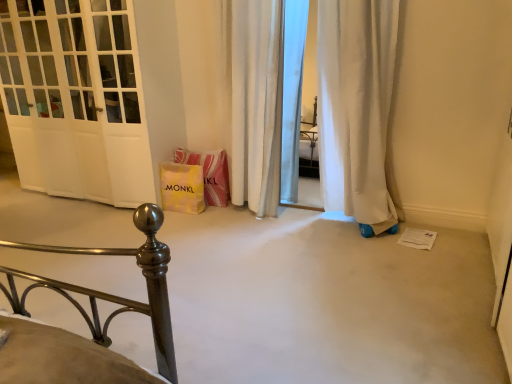
Question: Considering the relative positions of white fabric curtain at center and yellow paper bag at center in the image provided, is white fabric curtain at center to the left of yellow paper bag at center from the viewer's perspective?

Choices:
 (A) no
 (B) yes

Answer: (A)

Question: From a real-world perspective, is white fabric curtain at center on yellow paper bag at center?

Choices:
 (A) no
 (B) yes

Answer: (B)

Question: Is white fabric curtain at center smaller than yellow paper bag at center?

Choices:
 (A) yes
 (B) no

Answer: (B)

Question: Is white fabric curtain at center completely or partially outside of yellow paper bag at center?

Choices:
 (A) yes
 (B) no

Answer: (A)

Question: Is there a large distance between white fabric curtain at center and yellow paper bag at center?

Choices:
 (A) no
 (B) yes

Answer: (A)

Question: Is white fabric curtain at center placed right next to yellow paper bag at center?

Choices:
 (A) yes
 (B) no

Answer: (B)

Question: Can you confirm if yellow paper bag at lower center is wider than white fabric curtain at center?

Choices:
 (A) yes
 (B) no

Answer: (B)

Question: Is yellow paper bag at lower center with white fabric curtain at center?

Choices:
 (A) no
 (B) yes

Answer: (A)

Question: Does yellow paper bag at lower center have a greater height compared to white fabric curtain at center?

Choices:
 (A) yes
 (B) no

Answer: (B)

Question: From the image's perspective, is yellow paper bag at lower center over white fabric curtain at center?

Choices:
 (A) no
 (B) yes

Answer: (A)

Question: Is white fabric curtain at center surrounded by yellow paper bag at lower center?

Choices:
 (A) no
 (B) yes

Answer: (A)

Question: Considering the relative positions of yellow paper bag at lower center and white fabric curtain at center in the image provided, is yellow paper bag at lower center to the left of white fabric curtain at center from the viewer's perspective?

Choices:
 (A) yes
 (B) no

Answer: (A)

Question: From the image's perspective, would you say yellow paper bag at center is shown under white glossy door at left?

Choices:
 (A) no
 (B) yes

Answer: (B)